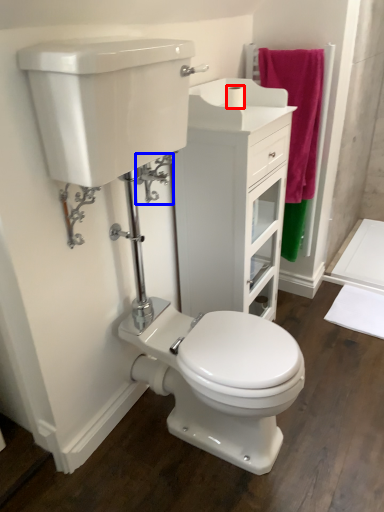
Question: Which object appears closest to the camera in this image, toilet paper (highlighted by a red box) or plumbing fixture (highlighted by a blue box)?

Choices:
 (A) toilet paper
 (B) plumbing fixture

Answer: (B)